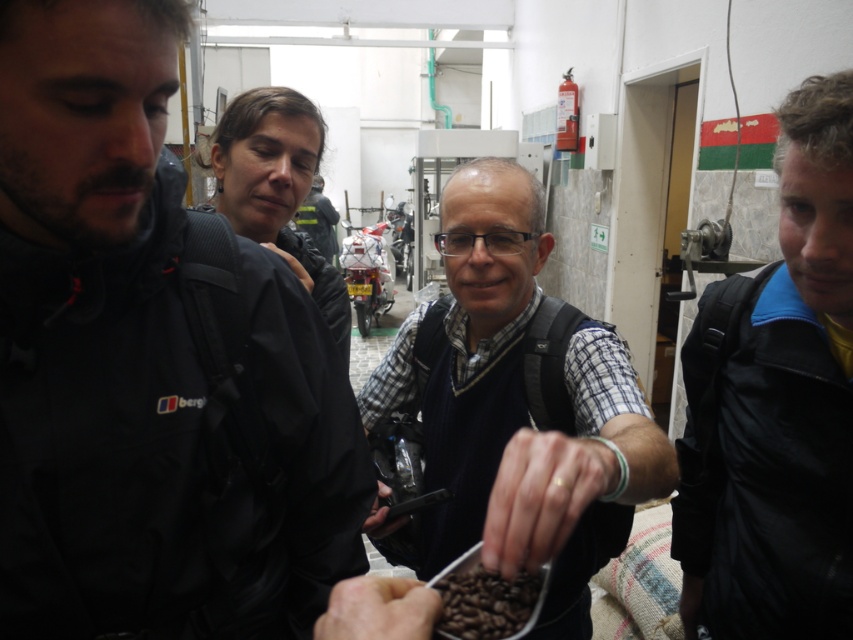
You are a GUI agent. You are given a task and a screenshot of the screen. Output one action in this format:
    pyautogui.click(x=<x>, y=<y>)
    Task: Click on the checkered fabric shirt at center
    
    Given the screenshot: What is the action you would take?
    pyautogui.click(x=514, y=410)

Does checkered fabric shirt at center appear over brown matte coffee beans at center?

Yes, checkered fabric shirt at center is above brown matte coffee beans at center.

Does point (572, 486) come farther from viewer compared to point (456, 612)?

Yes, point (572, 486) is behind point (456, 612).

Where is `checkered fabric shirt at center`? The height and width of the screenshot is (640, 853). checkered fabric shirt at center is located at coordinates (514, 410).

Between matte black jacket at left and brown matte coffee beans at center, which one appears on the right side from the viewer's perspective?

From the viewer's perspective, brown matte coffee beans at center appears more on the right side.

Can you confirm if matte black jacket at left is positioned above brown matte coffee beans at center?

Yes, matte black jacket at left is above brown matte coffee beans at center.

This screenshot has width=853, height=640. I want to click on matte black jacket at left, so pyautogui.click(x=144, y=369).

Can you confirm if black leather jacket at right is positioned to the left of brown matte coffee beans at center?

No, black leather jacket at right is not to the left of brown matte coffee beans at center.

Is point (805, 410) positioned in front of point (508, 589)?

No, it is not.

This screenshot has width=853, height=640. I want to click on black leather jacket at right, so click(776, 404).